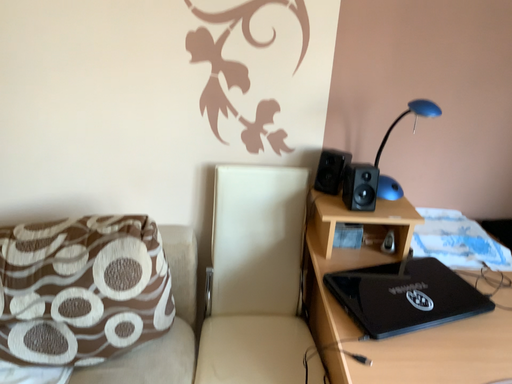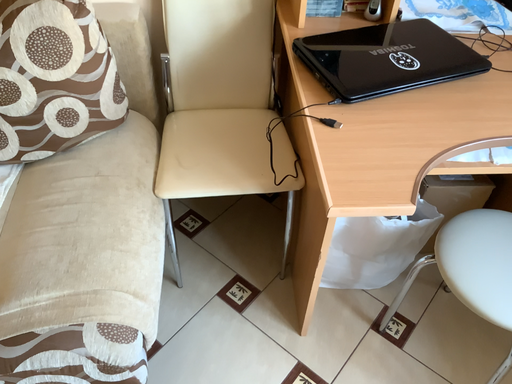
Question: How did the camera likely rotate when shooting the video?

Choices:
 (A) rotated upward
 (B) rotated downward

Answer: (B)